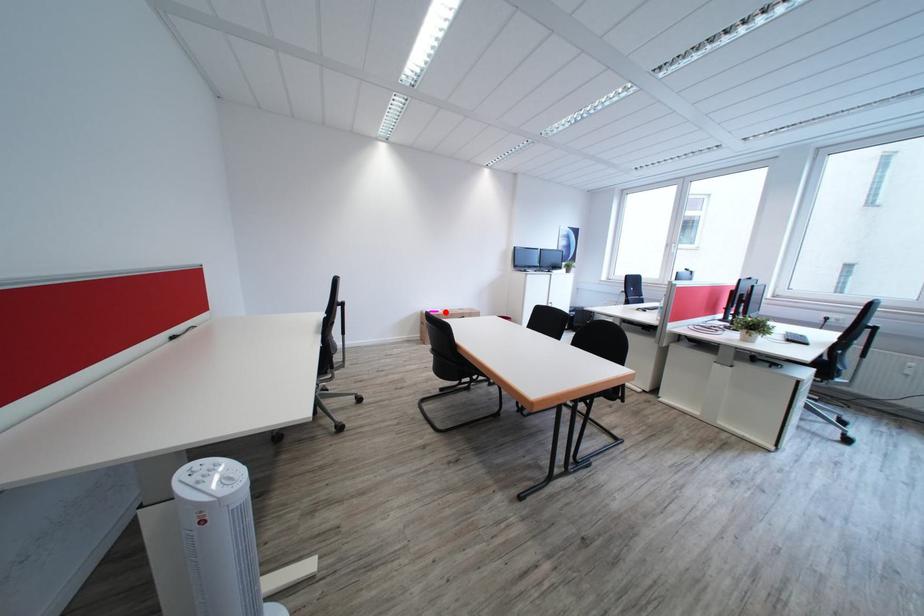
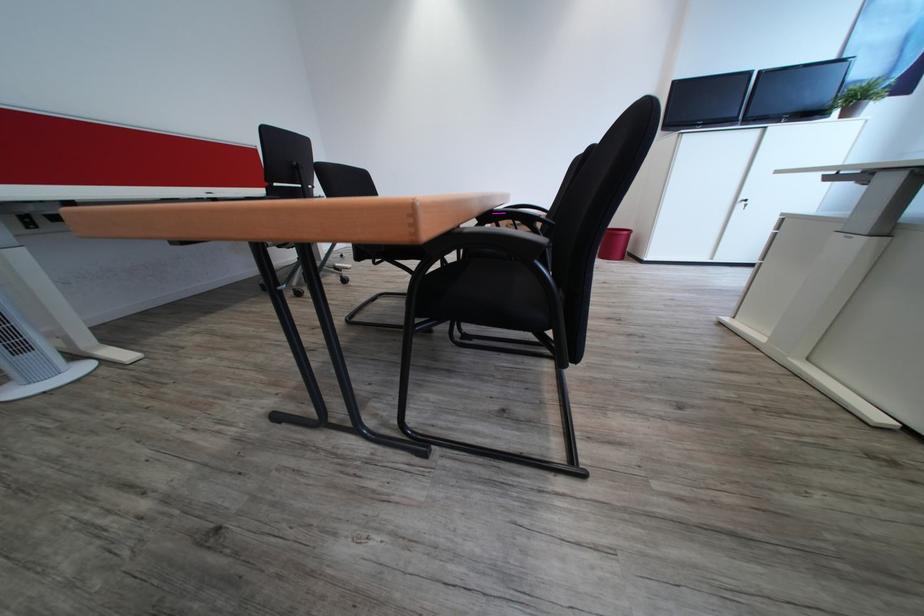
Question: I am providing you with two images of the same scene from different viewpoints. A red point is marked on the first image. Can you still see the location of the red point in image 2?

Choices:
 (A) Yes
 (B) No

Answer: (B)